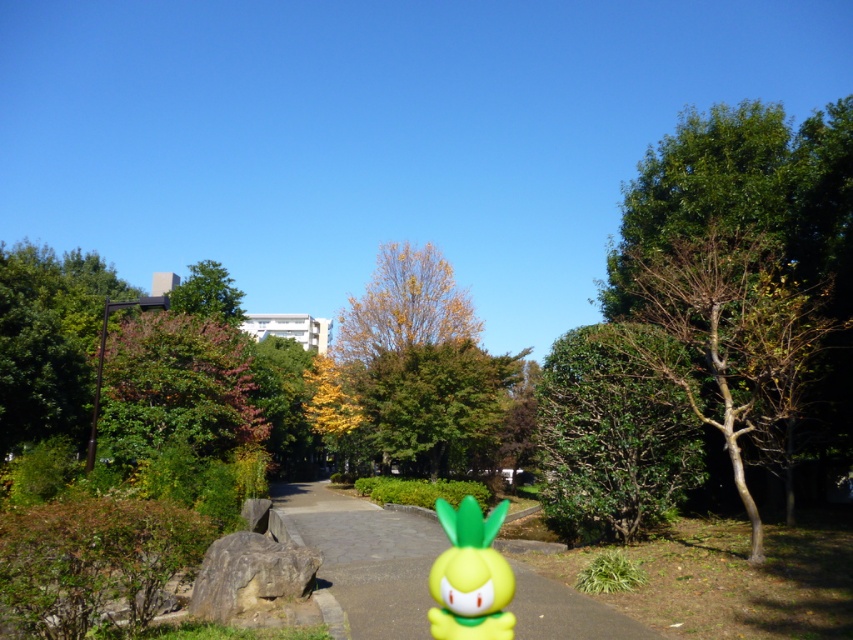
You are a park visitor holding a 30 feet long kite string. You want to fly a kite between the bright yellow toy pineapple figure at bottom center and the green leafy tree at right. Will the kite string be long enough to stretch between them?

The distance between the bright yellow toy pineapple figure at bottom center and the green leafy tree at right is 29.94 feet. Since the kite string is 30 feet long, it will be just long enough to stretch between them with a little extra length remaining.

You are standing at the starting point of the pathway in the park and see two points marked on the path ahead. The first point is at coordinates point (373, 532), and the second is at point (318, 397). Which point is closer to you as you walk along the pathway?

Point (373, 532) is in front of point (318, 397), so the first point is closer to you as you walk along the pathway.

You are a park maintenance worker needing to place a new bench between the green leafy tree at right and the green leafy tree at upper center. The bench requires 15 meters of space between the trees to be placed safely. Can you place the bench there?

The distance between the green leafy tree at right and the green leafy tree at upper center is 16.94 meters, which is more than the required 15 meters. Therefore, the bench can be placed safely between them.